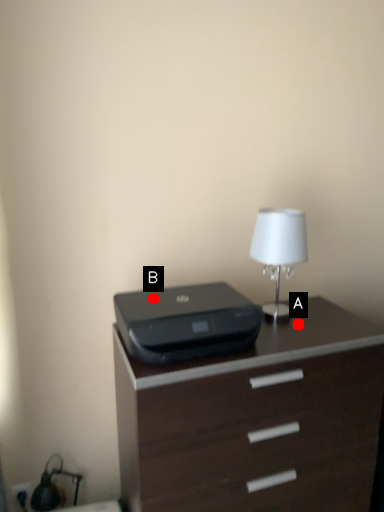
Question: Two points are circled on the image, labeled by A and B beside each circle. Which point appears closest to the camera in this image?

Choices:
 (A) A is closer
 (B) B is closer

Answer: (A)